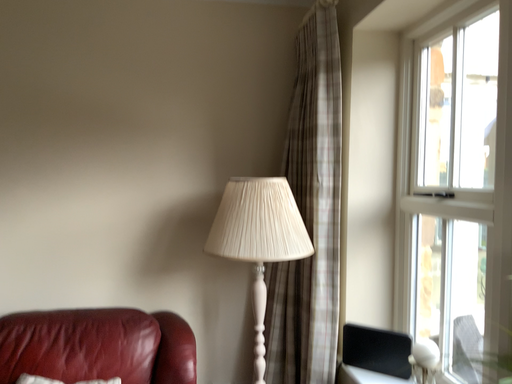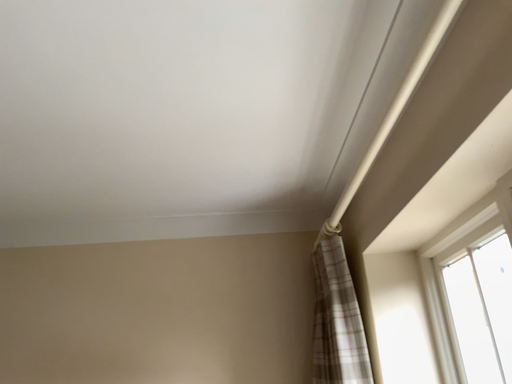
Question: How did the camera likely rotate when shooting the video?

Choices:
 (A) rotated downward
 (B) rotated upward

Answer: (B)